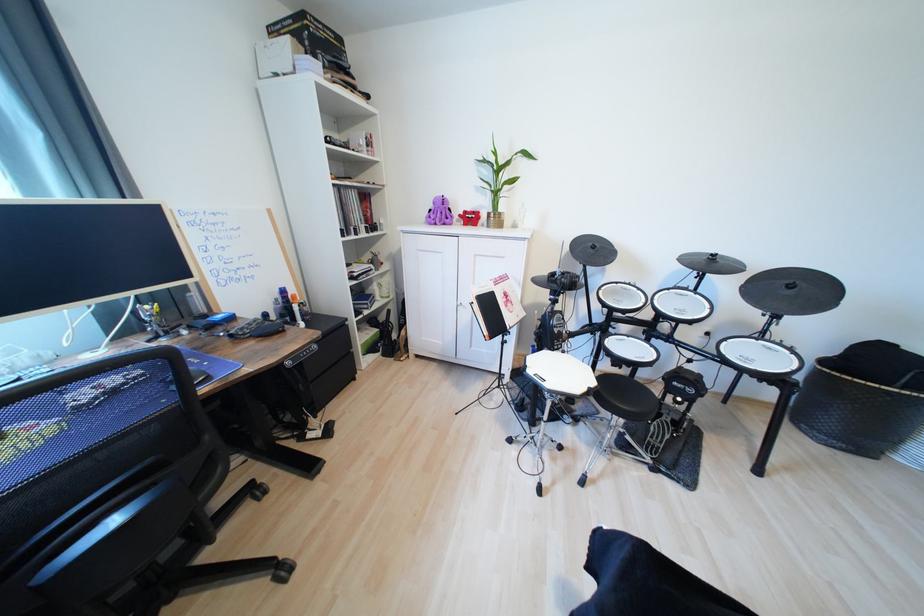
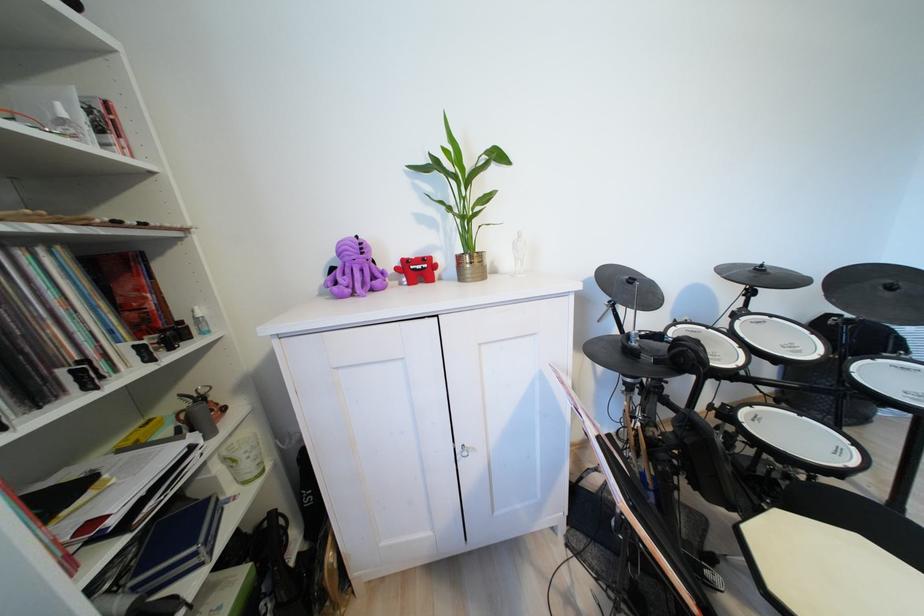
The point at (472, 214) is marked in the first image. Where is the corresponding point in the second image?

(411, 262)